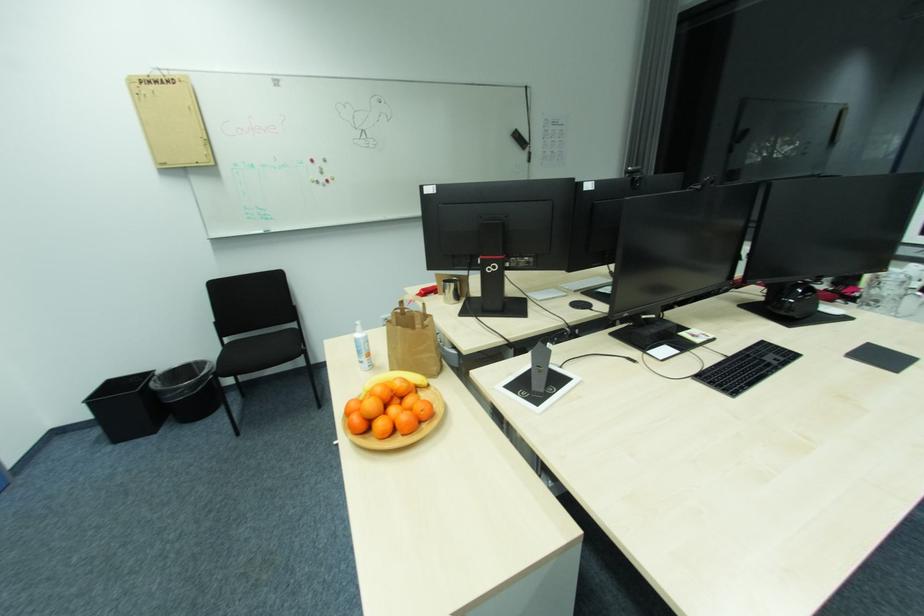
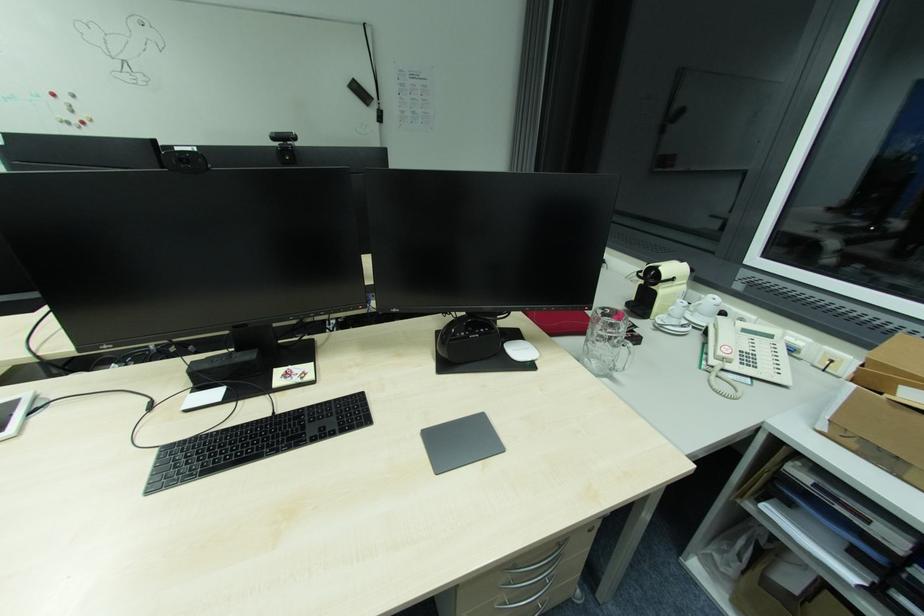
Question: What movement of the cameraman would produce the second image?

Choices:
 (A) Left
 (B) Right
 (C) Forward
 (D) Backward

Answer: (B)